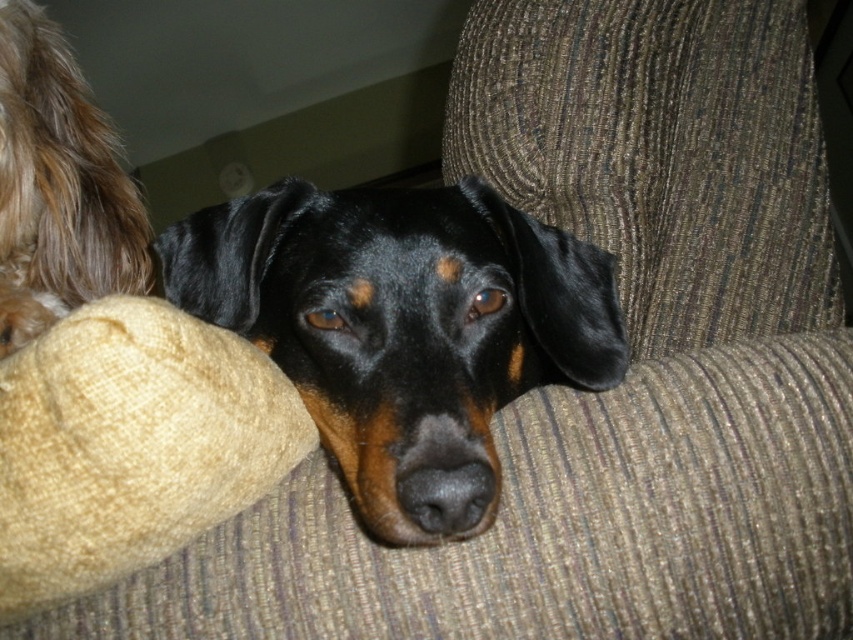
Question: Observing the image, what is the correct spatial positioning of black shiny dog at center in reference to fuzzy brown fur at upper left?

Choices:
 (A) above
 (B) below

Answer: (B)

Question: In this image, where is black shiny dog at center located relative to fuzzy brown fur at upper left?

Choices:
 (A) above
 (B) below

Answer: (B)

Question: Among these objects, which one is nearest to the camera?

Choices:
 (A) fuzzy brown fur at upper left
 (B) black shiny dog at center

Answer: (B)

Question: Which point appears closest to the camera in this image?

Choices:
 (A) (334, 435)
 (B) (4, 173)

Answer: (A)

Question: Is black shiny dog at center to the right of fuzzy brown fur at upper left from the viewer's perspective?

Choices:
 (A) no
 (B) yes

Answer: (B)